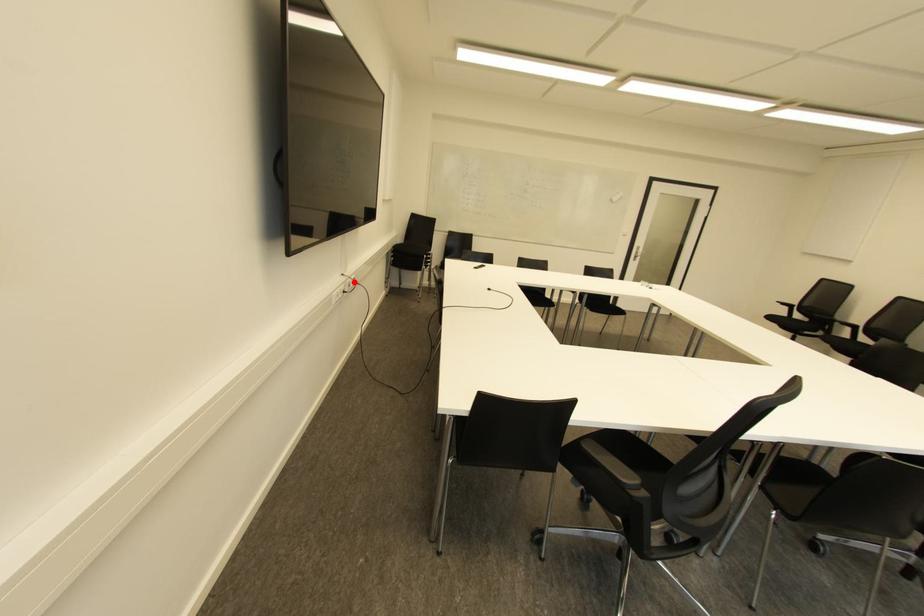
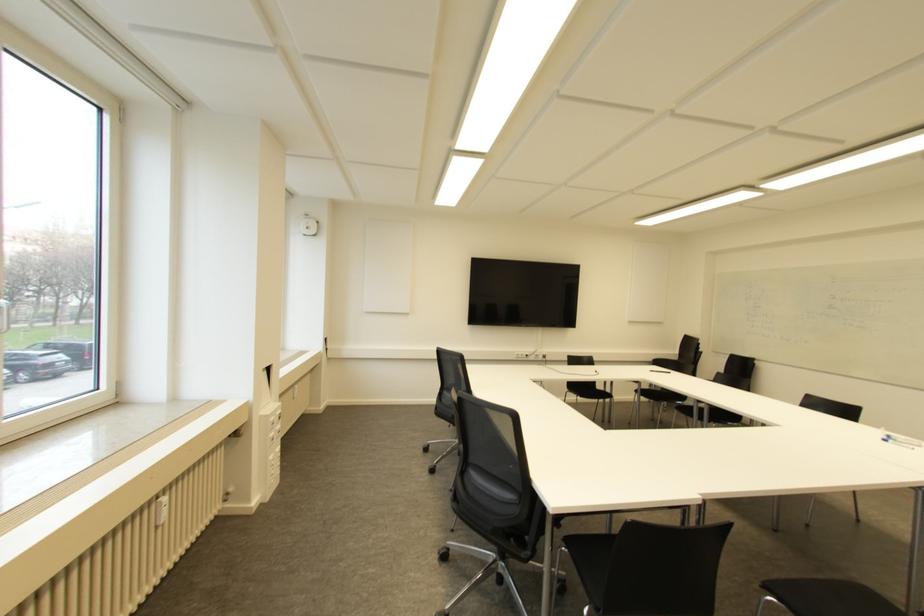
Question: I am providing you with two images of the same scene from different viewpoints. In image1, a red point is highlighted. Considering the same 3D point in image2, which of the following is correct?

Choices:
 (A) It is closer
 (B) It is farther

Answer: (B)